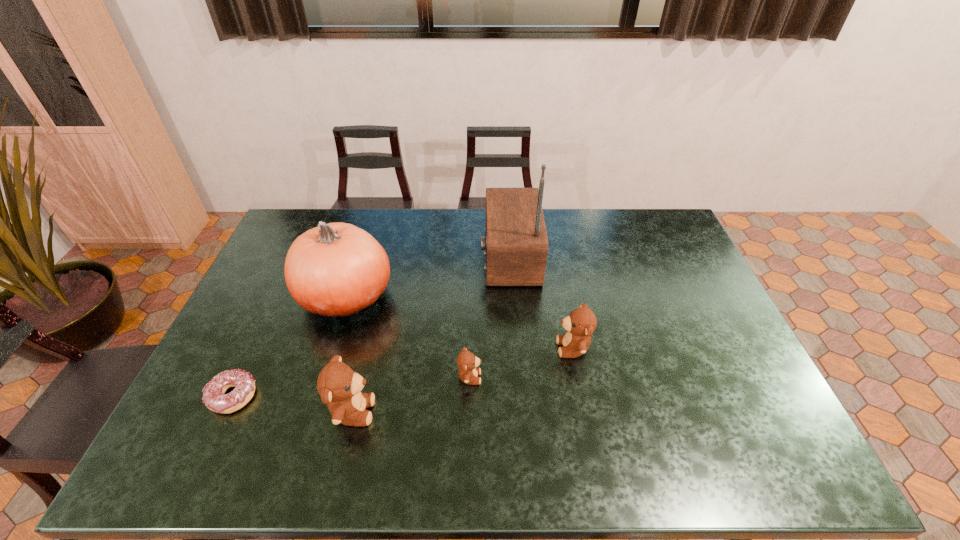
Locate which teddy bear ranks in proximity to the rightmost object. Please provide its 2D coordinates. Your answer should be formatted as a tuple, i.e. [(x, y)], where the tuple contains the x and y coordinates of a point satisfying the conditions above.

[(467, 362)]